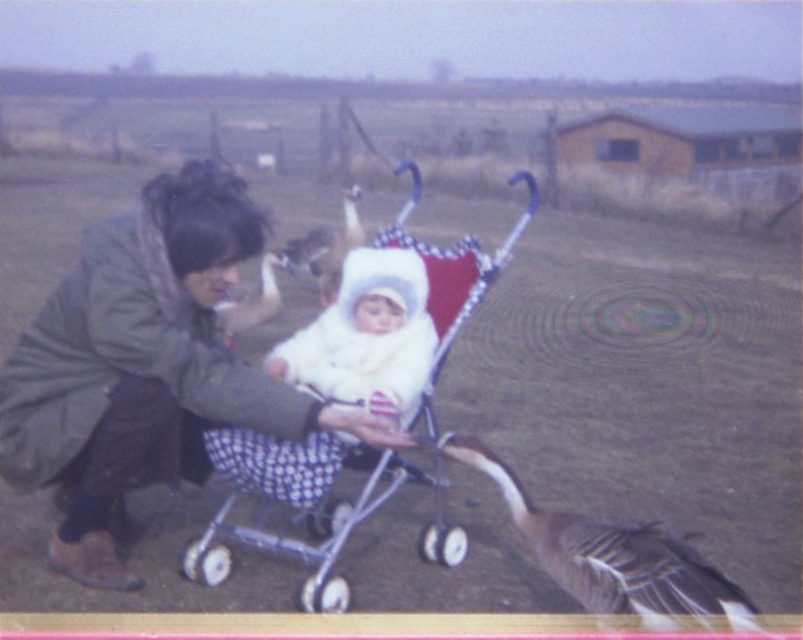
Question: Is green fuzzy coat at center wider than gray feathered goose at lower right?

Choices:
 (A) no
 (B) yes

Answer: (B)

Question: Which point appears farthest from the camera in this image?

Choices:
 (A) (418, 323)
 (B) (47, 476)
 (C) (304, 365)

Answer: (C)

Question: In this image, where is green fuzzy coat at center located relative to white fluffy baby carriage at center?

Choices:
 (A) above
 (B) below

Answer: (B)

Question: Which point appears closest to the camera in this image?

Choices:
 (A) (704, 563)
 (B) (88, 541)

Answer: (A)

Question: Can you confirm if green fuzzy coat at center is wider than gray feathered goose at lower right?

Choices:
 (A) yes
 (B) no

Answer: (A)

Question: Estimate the real-world distances between objects in this image. Which object is farther from the polka dot fabric baby carriage at center?

Choices:
 (A) white fluffy baby carriage at center
 (B) gray feathered goose at lower right
 (C) green fuzzy coat at center

Answer: (B)